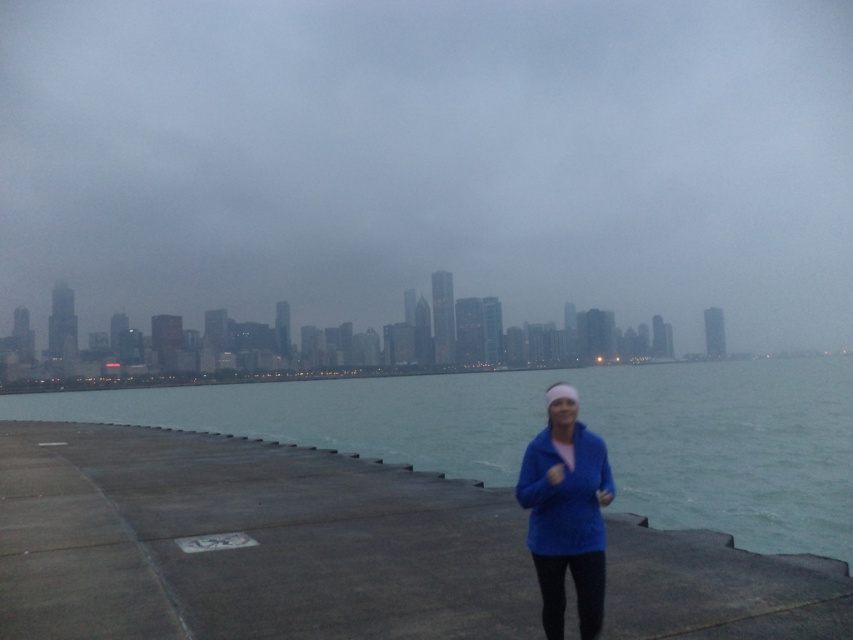
Question: Which point appears farthest from the camera in this image?

Choices:
 (A) (584, 490)
 (B) (392, 408)

Answer: (B)

Question: Does foggy skyline at center have a larger size compared to blue fleece jacket at lower right?

Choices:
 (A) yes
 (B) no

Answer: (A)

Question: Does greenish-blue water at center have a smaller size compared to blue fleece jacket at lower right?

Choices:
 (A) no
 (B) yes

Answer: (A)

Question: Which object is the closest to the foggy skyline at center?

Choices:
 (A) greenish-blue water at center
 (B) blue fleece jacket at lower right

Answer: (A)

Question: Which object appears farthest from the camera in this image?

Choices:
 (A) foggy skyline at center
 (B) blue fleece jacket at lower right
 (C) greenish-blue water at center

Answer: (A)

Question: Can you confirm if foggy skyline at center is bigger than blue fleece jacket at lower right?

Choices:
 (A) no
 (B) yes

Answer: (B)